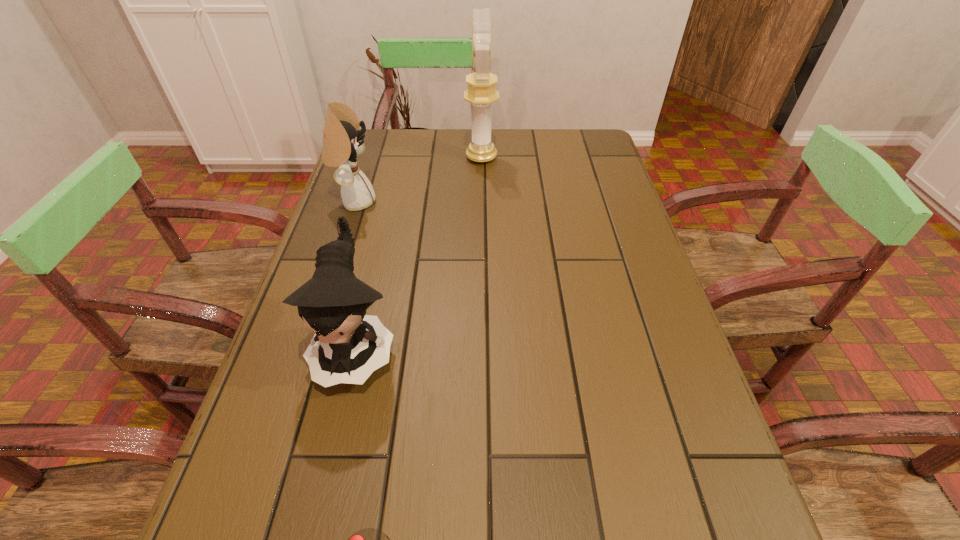
Where is `the tallest object`? the tallest object is located at coordinates (481, 93).

Image resolution: width=960 pixels, height=540 pixels. I want to click on award, so click(x=481, y=93).

You are a GUI agent. You are given a task and a screenshot of the screen. Output one action in this format:
    pyautogui.click(x=<x>, y=<y>)
    Task: Click on the second farthest object
    
    Given the screenshot: What is the action you would take?
    pyautogui.click(x=342, y=143)

Locate an element on the screen. Image resolution: width=960 pixels, height=540 pixels. the third farthest object is located at coordinates (347, 347).

Where is `free region located on the front-facing side of the tallest object`? The height and width of the screenshot is (540, 960). free region located on the front-facing side of the tallest object is located at coordinates (417, 158).

The image size is (960, 540). Find the location of `vacant region located on the front-facing side of the tallest object`. vacant region located on the front-facing side of the tallest object is located at coordinates (371, 158).

This screenshot has width=960, height=540. In order to click on vacant area located 0.240m on the front-facing side of the tallest object in this screenshot , I will do `click(387, 158)`.

Image resolution: width=960 pixels, height=540 pixels. What are the coordinates of `vacant area situated 0.130m at the front face of the farther doll` in the screenshot? It's located at (424, 201).

The width and height of the screenshot is (960, 540). I want to click on vacant region located at the face of the third farthest object, so click(338, 425).

Image resolution: width=960 pixels, height=540 pixels. In order to click on object that is at the far edge in this screenshot , I will do `click(481, 93)`.